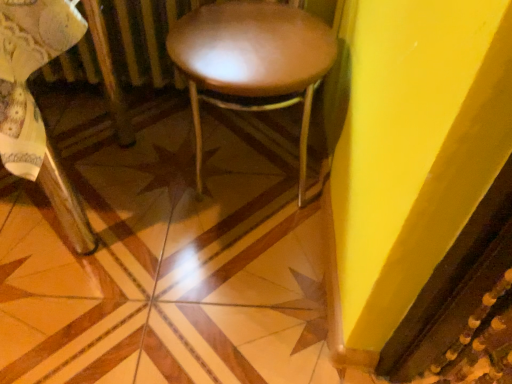
Question: Would you say wooden floor at center is to the left or to the right of leather-like brown stool at center in the picture?

Choices:
 (A) left
 (B) right

Answer: (A)

Question: In terms of size, does wooden floor at center appear bigger or smaller than leather-like brown stool at center?

Choices:
 (A) small
 (B) big

Answer: (A)

Question: Estimate the real-world distances between objects in this image. Which object is closer to the leather-like brown stool at center?

Choices:
 (A) wooden floor at center
 (B) wooden chair at center

Answer: (A)

Question: Which of these objects is positioned farthest from the leather-like brown stool at center?

Choices:
 (A) wooden floor at center
 (B) wooden chair at center

Answer: (B)